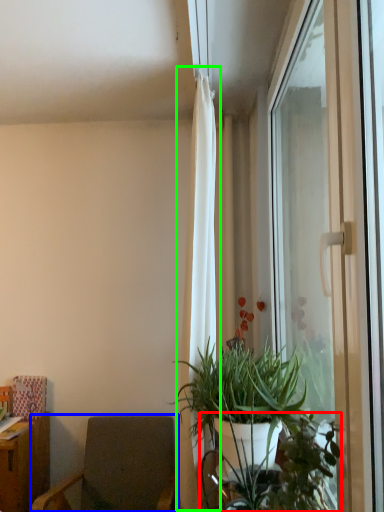
Question: Which object is positioned farthest from vegetation (highlighted by a red box)? Select from chair (highlighted by a blue box) and curtain (highlighted by a green box).

Choices:
 (A) chair
 (B) curtain

Answer: (A)